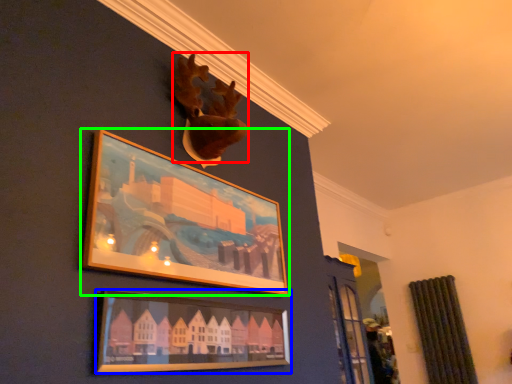
Question: Which is farther away from animal (highlighted by a red box)? picture frame (highlighted by a blue box) or picture frame (highlighted by a green box)?

Choices:
 (A) picture frame
 (B) picture frame

Answer: (A)